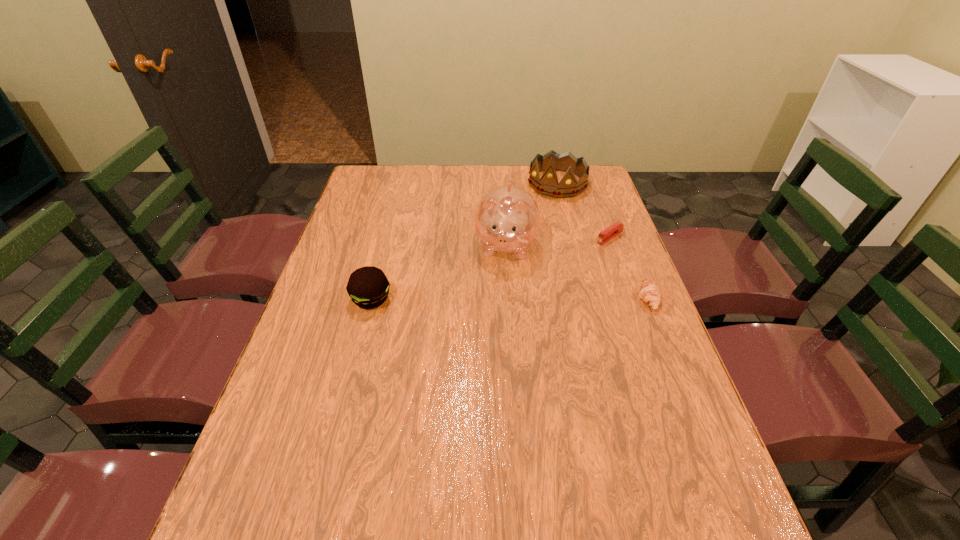
What are the coordinates of `free space located 0.340m on the front-facing side of the pastry` in the screenshot? It's located at (513, 299).

This screenshot has height=540, width=960. Identify the location of vacant position located on the front-facing side of the stapler. (556, 272).

The width and height of the screenshot is (960, 540). I want to click on free location located on the front-facing side of the stapler, so click(571, 261).

Image resolution: width=960 pixels, height=540 pixels. Find the location of `vacant point located 0.320m on the front-facing side of the stapler`. vacant point located 0.320m on the front-facing side of the stapler is located at coordinates (529, 289).

Locate an element on the screen. free spot located at the front of the tiara with jewels is located at coordinates (506, 253).

At what (x,y) coordinates should I click in order to perform the action: click on vacant area situated 0.250m at the front of the tiara with jewels. Please return your answer as a coordinate pair (x, y). Looking at the image, I should click on (519, 235).

The image size is (960, 540). Identify the location of vacant space located at the front of the tiara with jewels. (499, 263).

Image resolution: width=960 pixels, height=540 pixels. Find the location of `blank space located on the front facing side of the piggy bank`. blank space located on the front facing side of the piggy bank is located at coordinates (488, 354).

Find the location of a particular element. This screenshot has width=960, height=540. free space located on the front facing side of the piggy bank is located at coordinates (485, 371).

Where is `free location located on the front facing side of the piggy bank`? free location located on the front facing side of the piggy bank is located at coordinates (483, 382).